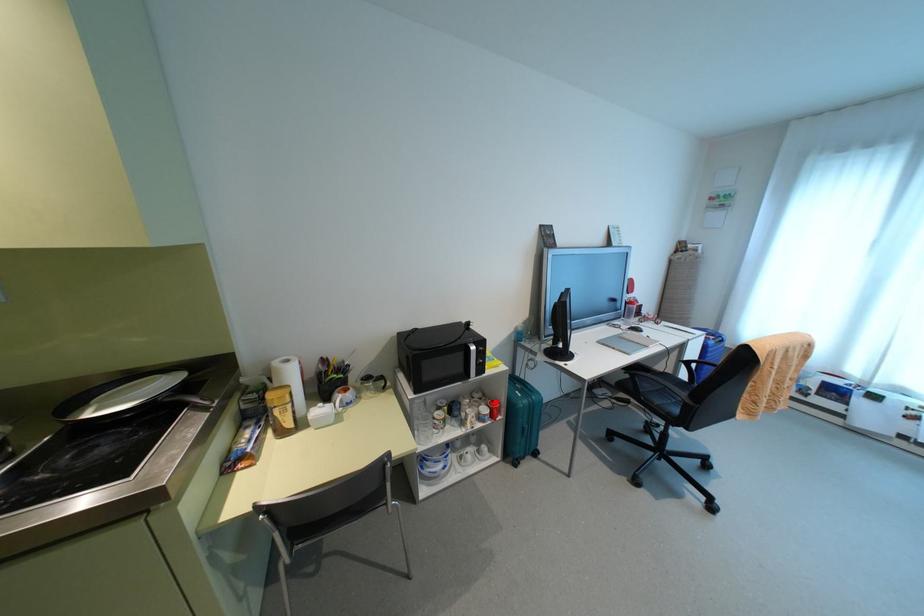
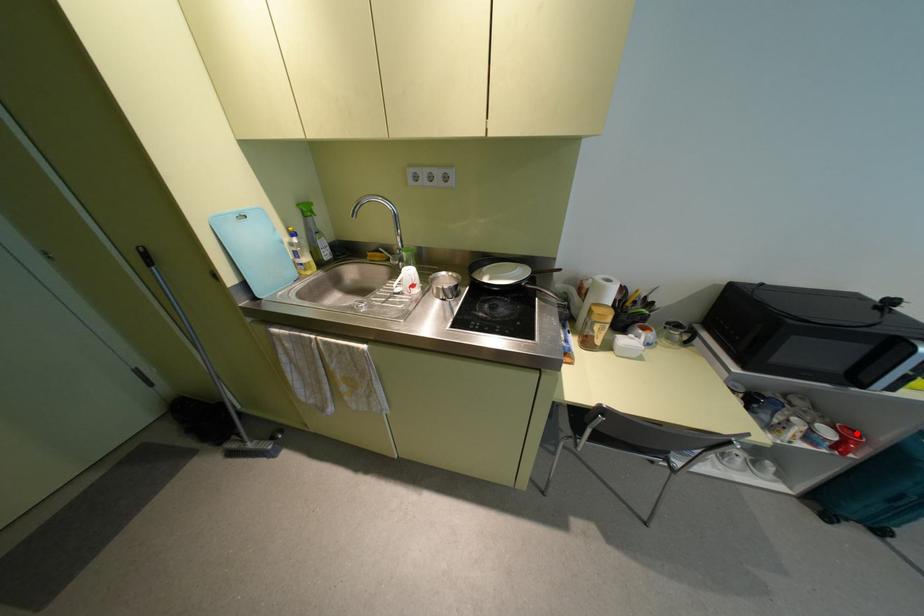
I am providing you with two images of the same scene from different viewpoints. A red point is marked on the first image and another point is marked on the second image. Is the red point in image1 aligned with the point shown in image2?

Yes